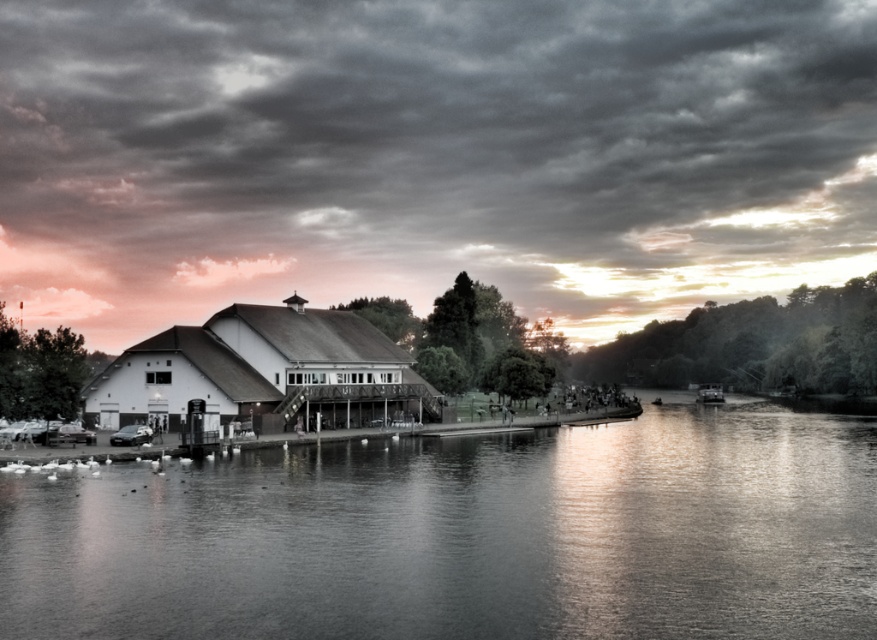
You are an architect designing a new lakeside building. You want to ensure that the building does not block the view of the cloudy sky at upper center from the smooth water at center. Based on their sizes, which object should you prioritize keeping unobstructed to maintain the scenic view?

The cloudy sky at upper center is larger in size than the smooth water at center, so you should prioritize keeping the cloudy sky at upper center unobstructed to maintain the scenic view.